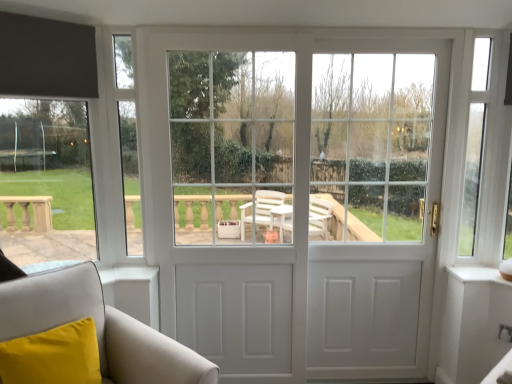
I want to click on vacant point above white glossy door at center, which is the second screen door in right-to-left order (from a real-world perspective), so click(x=246, y=34).